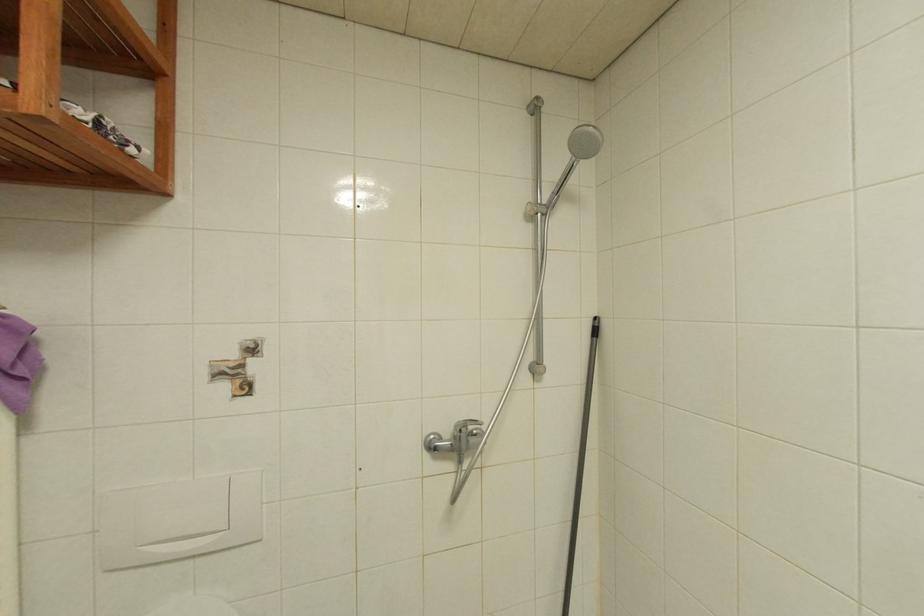
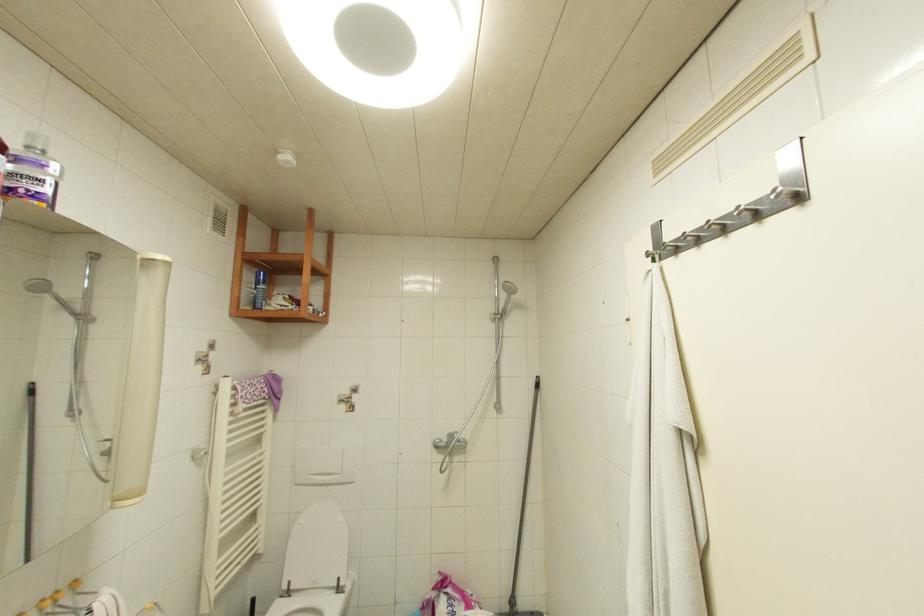
The images are taken continuously from a first-person perspective. In which direction are you moving?

The cameraman walked toward right, backward.